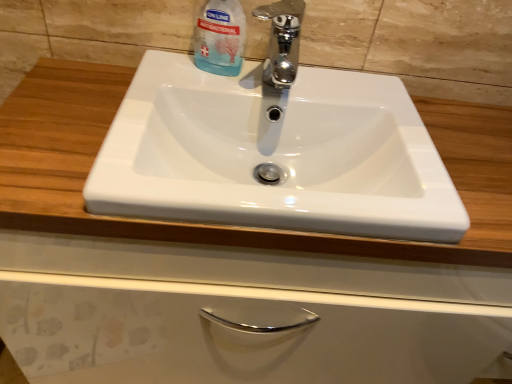
Question: Does point (282, 66) appear closer or farther from the camera than point (210, 26)?

Choices:
 (A) farther
 (B) closer

Answer: (A)

Question: Considering the positions of chrome metallic faucet at center and transparent plastic bottle at upper center in the image, is chrome metallic faucet at center taller or shorter than transparent plastic bottle at upper center?

Choices:
 (A) short
 (B) tall

Answer: (A)

Question: Estimate the real-world distances between objects in this image. Which object is farther from the white glossy sink at center?

Choices:
 (A) transparent plastic bottle at upper center
 (B) chrome metallic faucet at center

Answer: (A)

Question: Which object is the farthest from the white glossy sink at center?

Choices:
 (A) transparent plastic bottle at upper center
 (B) chrome metallic faucet at center

Answer: (A)